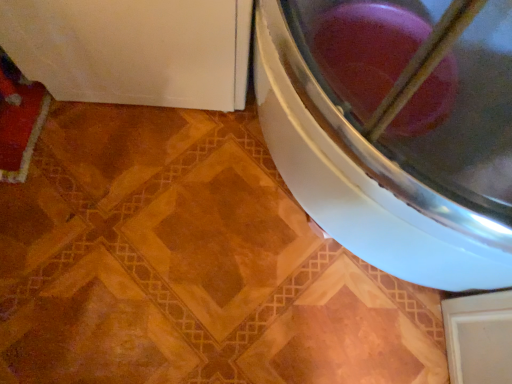
Question: Does white glossy washing machine at lower left have a greater width compared to white glossy washing machine at lower right?

Choices:
 (A) no
 (B) yes

Answer: (A)

Question: From the image's perspective, is white glossy washing machine at lower left under white glossy washing machine at lower right?

Choices:
 (A) yes
 (B) no

Answer: (B)

Question: From the image's perspective, does white glossy washing machine at lower left appear higher than white glossy washing machine at lower right?

Choices:
 (A) no
 (B) yes

Answer: (B)

Question: Is white glossy washing machine at lower left shorter than white glossy washing machine at lower right?

Choices:
 (A) no
 (B) yes

Answer: (B)

Question: From a real-world perspective, is white glossy washing machine at lower left located beneath white glossy washing machine at lower right?

Choices:
 (A) no
 (B) yes

Answer: (B)

Question: Is white glossy washing machine at lower left positioned before white glossy washing machine at lower right?

Choices:
 (A) yes
 (B) no

Answer: (B)

Question: Are white glossy washing machine at lower right and white glossy washing machine at lower left making contact?

Choices:
 (A) no
 (B) yes

Answer: (A)

Question: Does white glossy washing machine at lower right have a greater width compared to white glossy washing machine at lower left?

Choices:
 (A) yes
 (B) no

Answer: (A)

Question: From the image's perspective, is white glossy washing machine at lower right above white glossy washing machine at lower left?

Choices:
 (A) no
 (B) yes

Answer: (A)

Question: Does white glossy washing machine at lower right appear on the right side of white glossy washing machine at lower left?

Choices:
 (A) yes
 (B) no

Answer: (A)

Question: Is white glossy washing machine at lower right not within white glossy washing machine at lower left?

Choices:
 (A) yes
 (B) no

Answer: (A)

Question: Considering the relative sizes of white glossy washing machine at lower right and white glossy washing machine at lower left in the image provided, is white glossy washing machine at lower right bigger than white glossy washing machine at lower left?

Choices:
 (A) no
 (B) yes

Answer: (B)

Question: In the image, is white glossy washing machine at lower right on the left side or the right side of white glossy washing machine at lower left?

Choices:
 (A) left
 (B) right

Answer: (B)